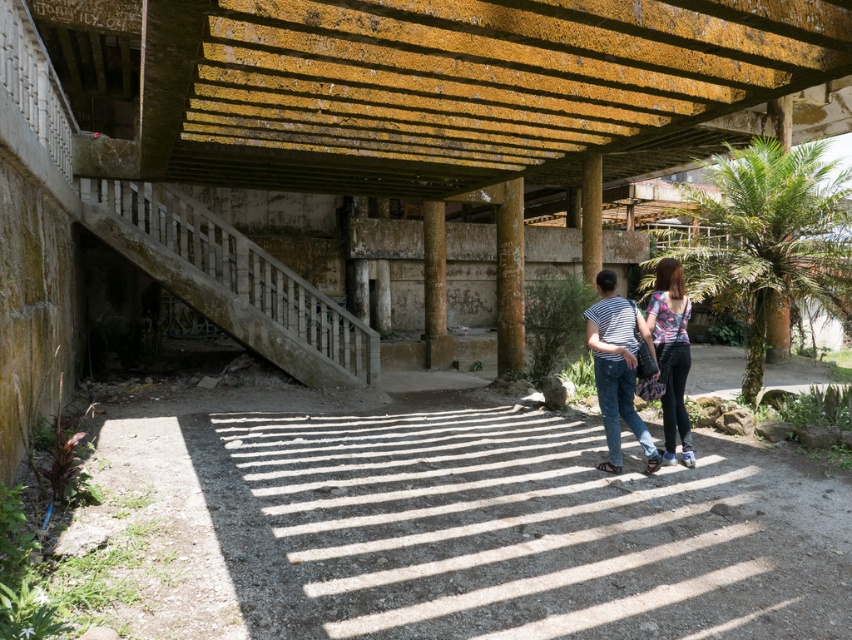
You are standing at the point marked by the coordinates point (475, 529). Looking around, you see the gray gravel path at center. Which direction should you walk to avoid the shadows cast by the beams above?

The gray gravel path at center is represented by point (475, 529). Since the beams cast shadows onto the path, walking perpendicular to the shadows would help avoid them. However, without specific shadow direction details, the safest path would be to follow the gravel path at center as it is the main route.

You are standing at the point with coordinates point (640, 316) and want to walk towards the point with coordinates point (303, 508). Given the gravel path and the structure above, will you walk uphill or downhill?

Since point (303, 508) is in front of point (640, 316), you will be walking downhill towards it.